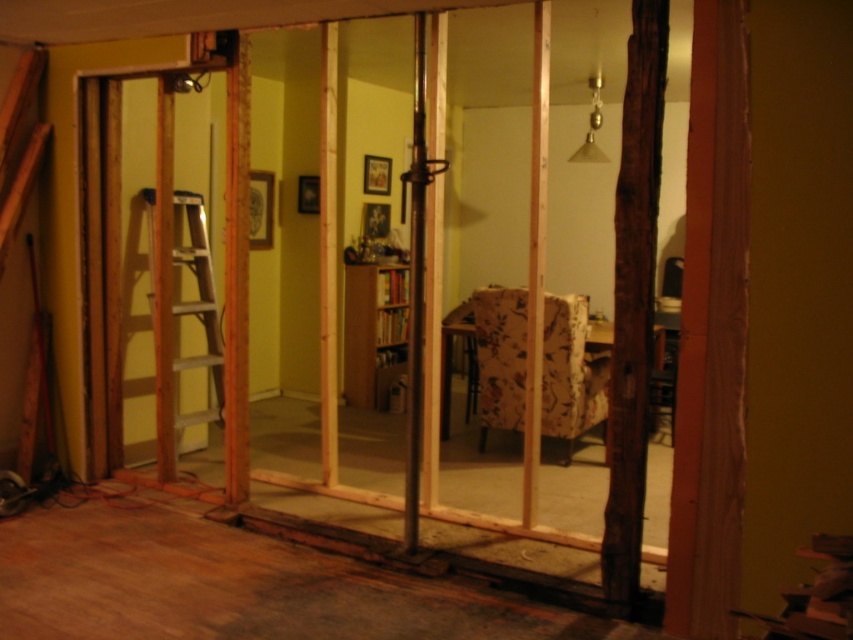
Question: Does wooden at left lie behind wooden ladder at left?

Choices:
 (A) no
 (B) yes

Answer: (A)

Question: Is wooden at left smaller than wooden ladder at left?

Choices:
 (A) no
 (B) yes

Answer: (A)

Question: Where is wooden at left located in relation to wooden ladder at left in the image?

Choices:
 (A) above
 (B) below

Answer: (A)

Question: Which point is closer to the camera taking this photo?

Choices:
 (A) (218, 388)
 (B) (109, 204)

Answer: (B)